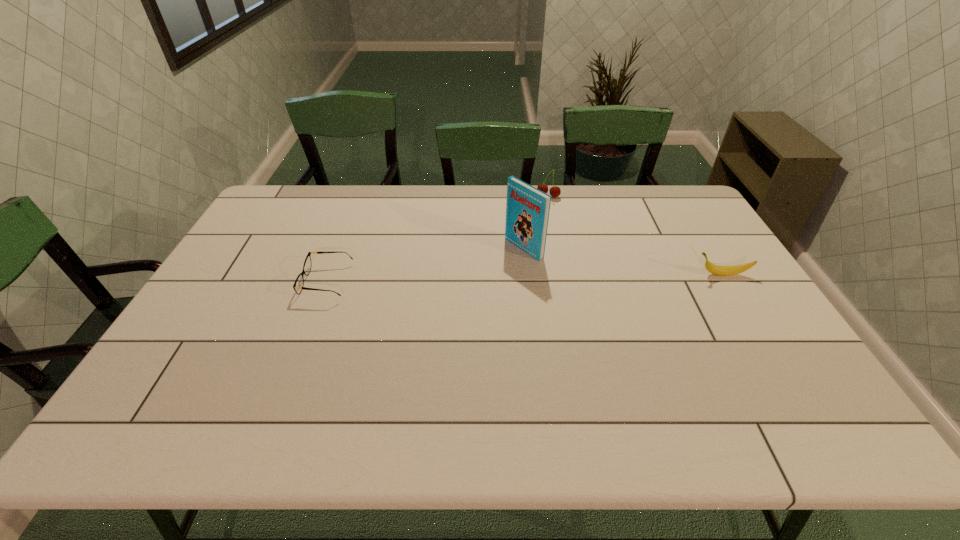
This screenshot has width=960, height=540. In order to click on vacant space located 0.240m on the front-facing side of the leftmost object in this screenshot , I will do `click(223, 281)`.

Find the location of a particular element. vacant space located 0.220m at the stem of the third tallest object is located at coordinates (619, 274).

Image resolution: width=960 pixels, height=540 pixels. What are the coordinates of `vacant space located 0.210m at the stem of the third tallest object` in the screenshot? It's located at (623, 274).

The height and width of the screenshot is (540, 960). I want to click on vacant position located at the stem of the third tallest object, so click(x=610, y=274).

Where is `vacant space situated 0.100m on the front cover of the third nearest object`? vacant space situated 0.100m on the front cover of the third nearest object is located at coordinates (487, 271).

Locate an element on the screen. The height and width of the screenshot is (540, 960). free spot located 0.250m on the front cover of the third nearest object is located at coordinates (447, 294).

This screenshot has height=540, width=960. I want to click on vacant region located 0.060m on the front cover of the third nearest object, so click(x=496, y=265).

Image resolution: width=960 pixels, height=540 pixels. I want to click on free space located on the surface of the farthest object, so click(521, 230).

Find the location of a particular element. free point located on the surface of the farthest object is located at coordinates (514, 239).

The width and height of the screenshot is (960, 540). I want to click on vacant area located on the surface of the farthest object, so click(x=508, y=248).